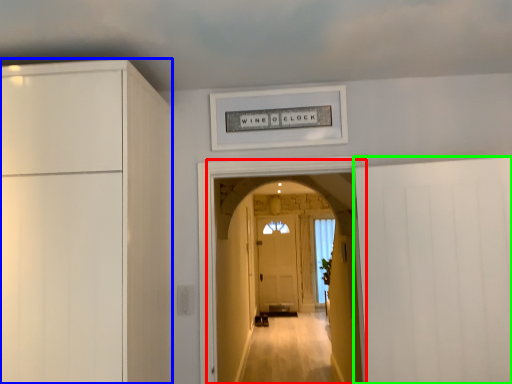
Question: Estimate the real-world distances between objects in this image. Which object is farther from corridor (highlighted by a red box), cabinetry (highlighted by a blue box) or door (highlighted by a green box)?

Choices:
 (A) cabinetry
 (B) door

Answer: (A)